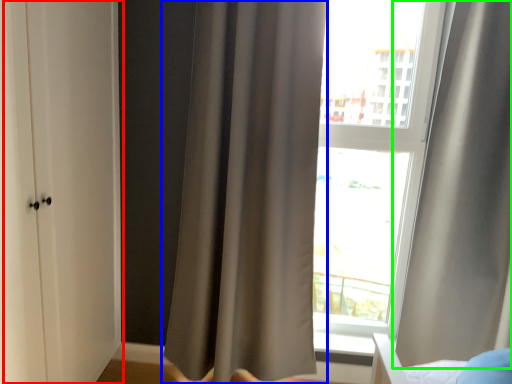
Question: Estimate the real-world distances between objects in this image. Which object is farther from screen door (highlighted by a red box), curtain (highlighted by a blue box) or curtain (highlighted by a green box)?

Choices:
 (A) curtain
 (B) curtain

Answer: (B)